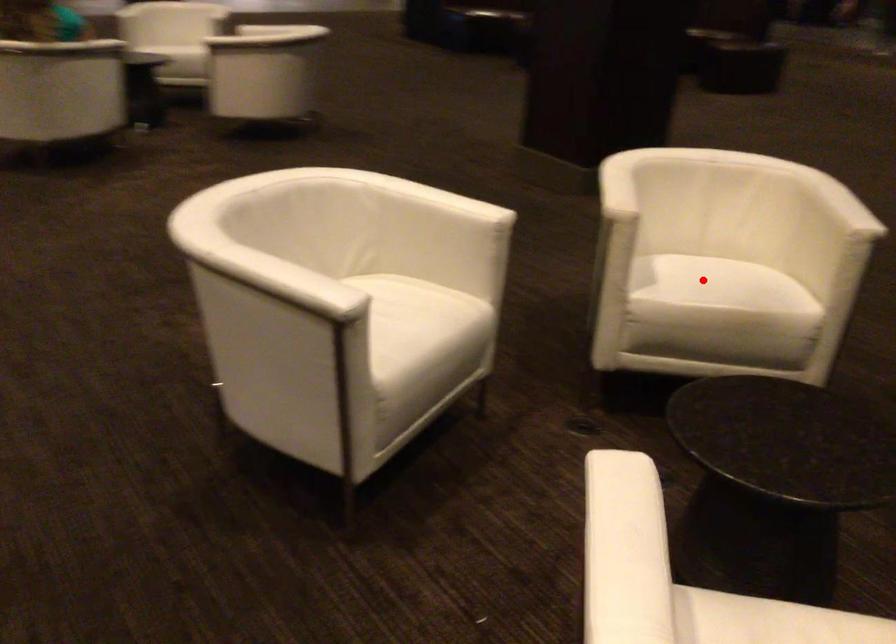
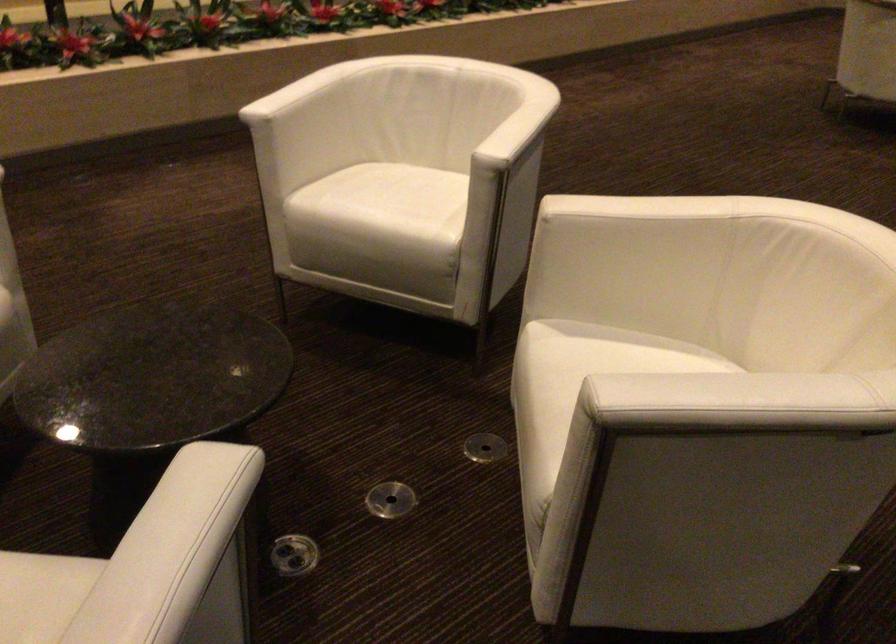
The point at the highlighted location is marked in the first image. Where is the corresponding point in the second image?

(581, 366)